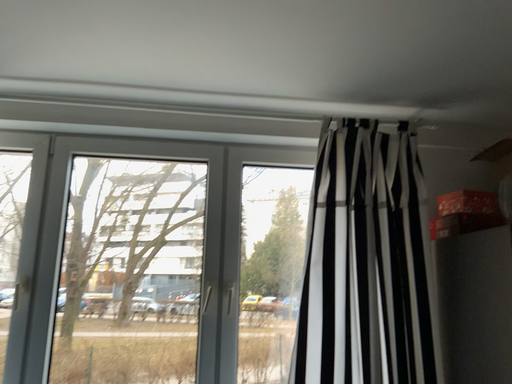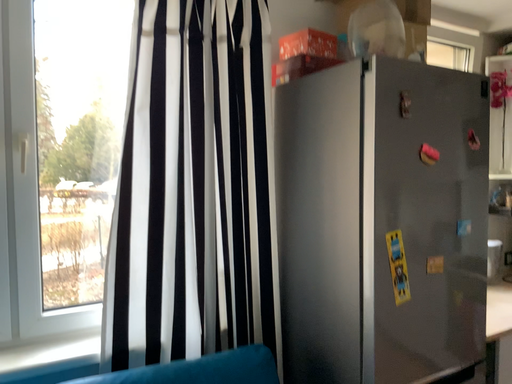
Question: How did the camera likely rotate when shooting the video?

Choices:
 (A) rotated left
 (B) rotated right

Answer: (B)